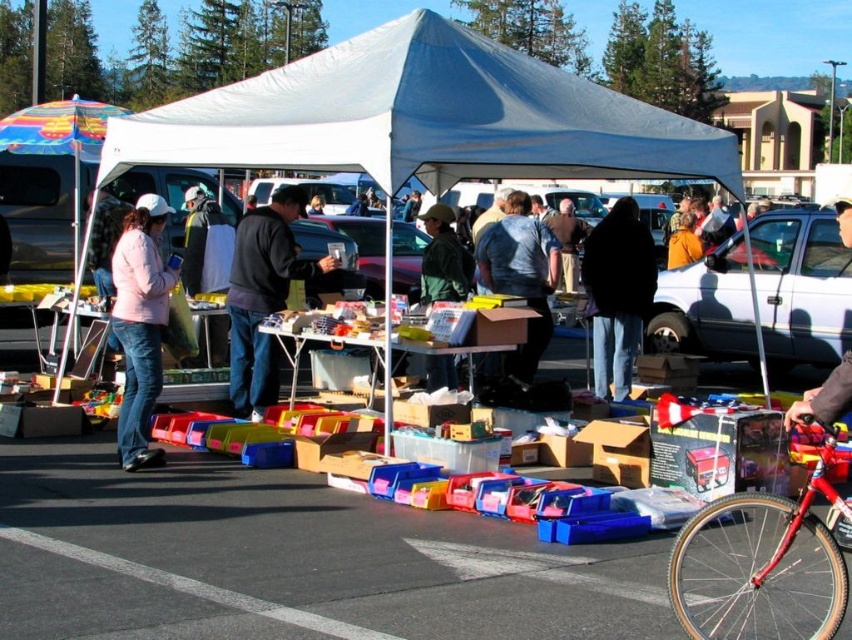
Question: Where is denim jacket at center located in relation to matte gray shirt at center in the image?

Choices:
 (A) right
 (B) left

Answer: (A)

Question: Considering the real-world distances, which object is farthest from the orange fleece jacket at center?

Choices:
 (A) white fabric tent at center
 (B) white fabric canopy at upper center
 (C) shiny red bicycle at lower right

Answer: (C)

Question: Can you confirm if matte gray shirt at center is positioned above green fabric jacket at center?

Choices:
 (A) yes
 (B) no

Answer: (B)

Question: Which point is farther from the camera taking this photo?

Choices:
 (A) (694, 240)
 (B) (274, 387)
 (C) (447, 376)

Answer: (A)

Question: Which object is positioned farthest from the pink fleece jacket at left?

Choices:
 (A) orange fleece jacket at center
 (B) white fabric canopy at upper center
 (C) shiny red bicycle at lower right

Answer: (A)

Question: Does white fabric tent at center appear on the left side of pink fleece jacket at left?

Choices:
 (A) yes
 (B) no

Answer: (B)